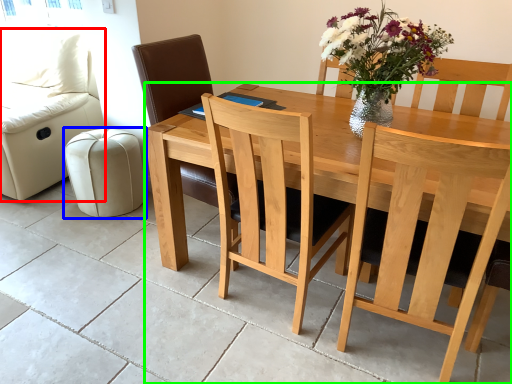
Question: Which object is positioned closest to couch (highlighted by a red box)? Select from stool (highlighted by a blue box) and table (highlighted by a green box).

Choices:
 (A) stool
 (B) table

Answer: (A)